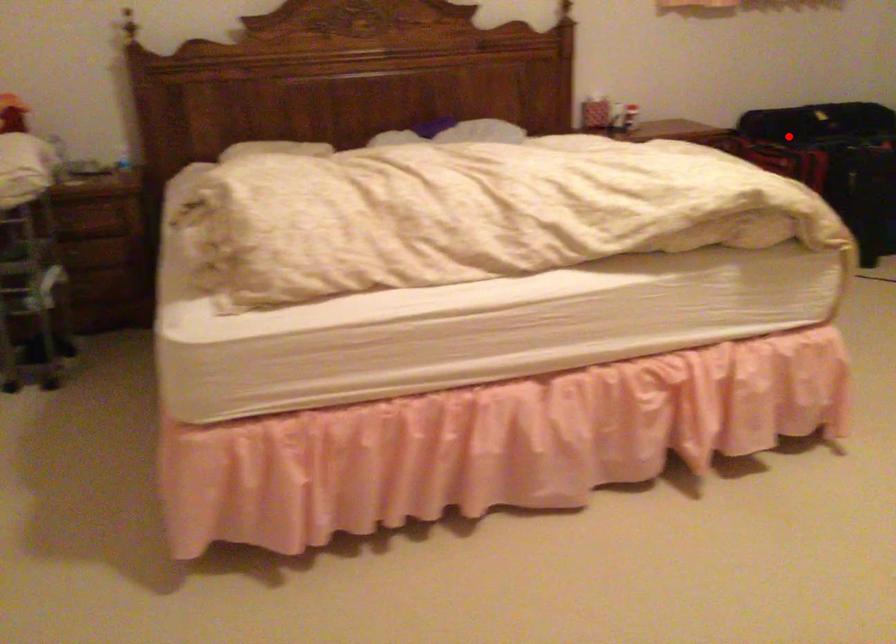
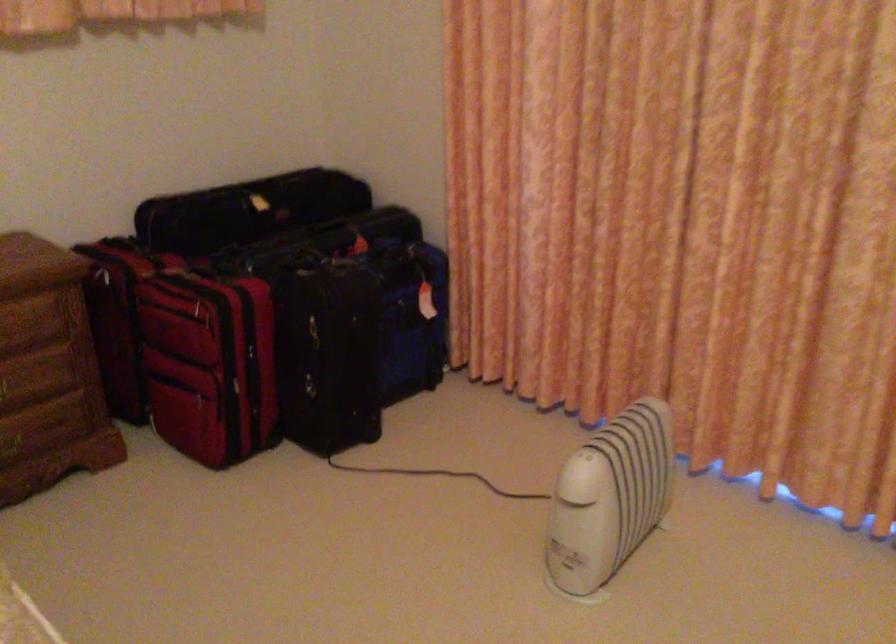
Find the pixel in the second image that matches the highlighted location in the first image.

(202, 305)